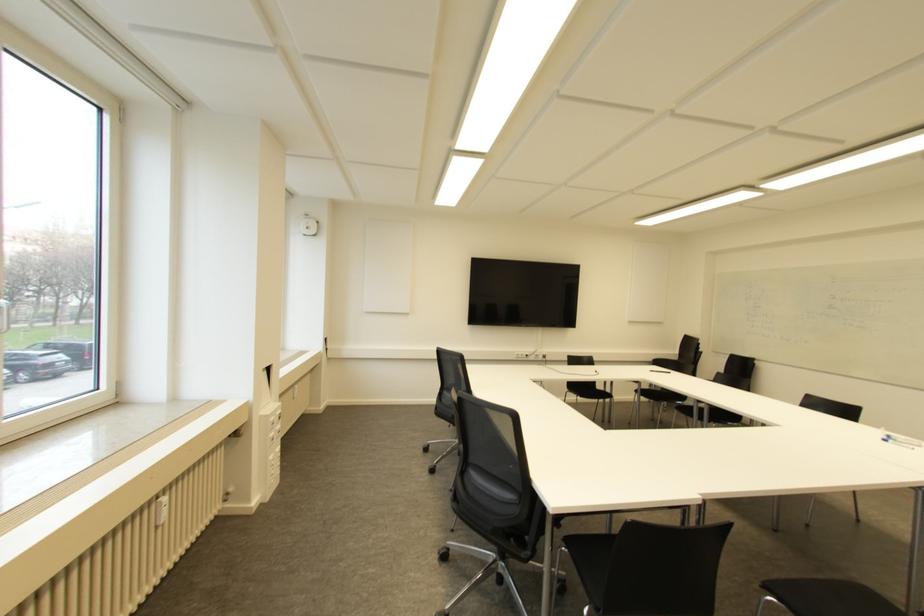
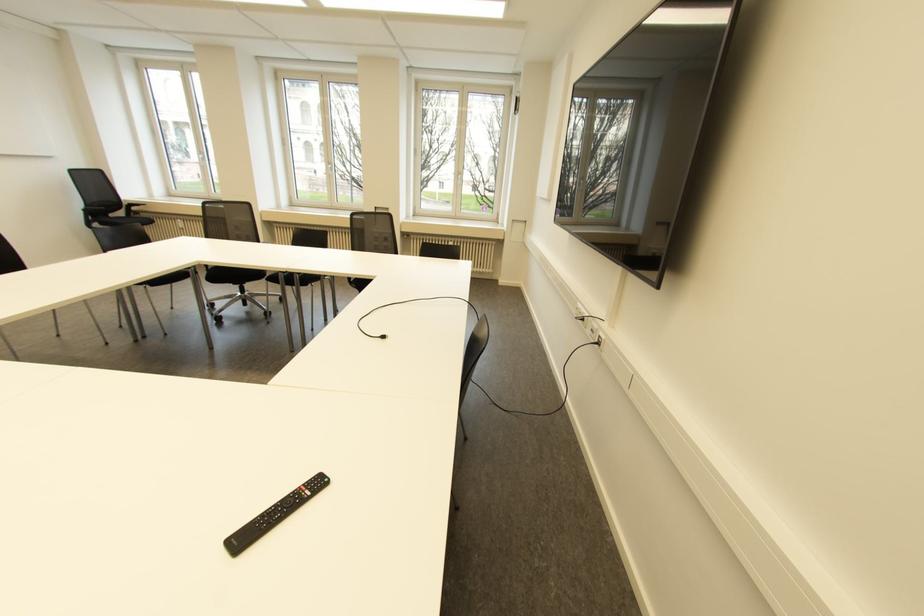
Find the pixel in the second image that matches [543,355] in the first image.

(598, 342)